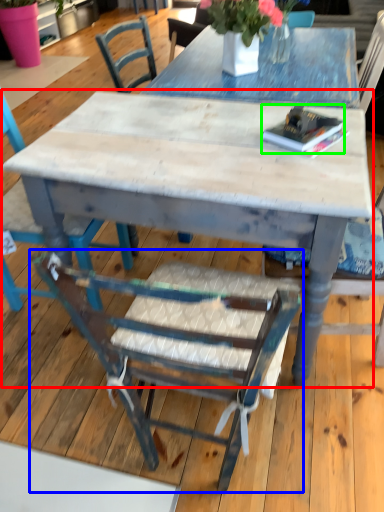
Question: Considering the real-world distances, which object is closest to kitchen & dining room table (highlighted by a red box)? chair (highlighted by a blue box) or book (highlighted by a green box).

Choices:
 (A) chair
 (B) book

Answer: (B)